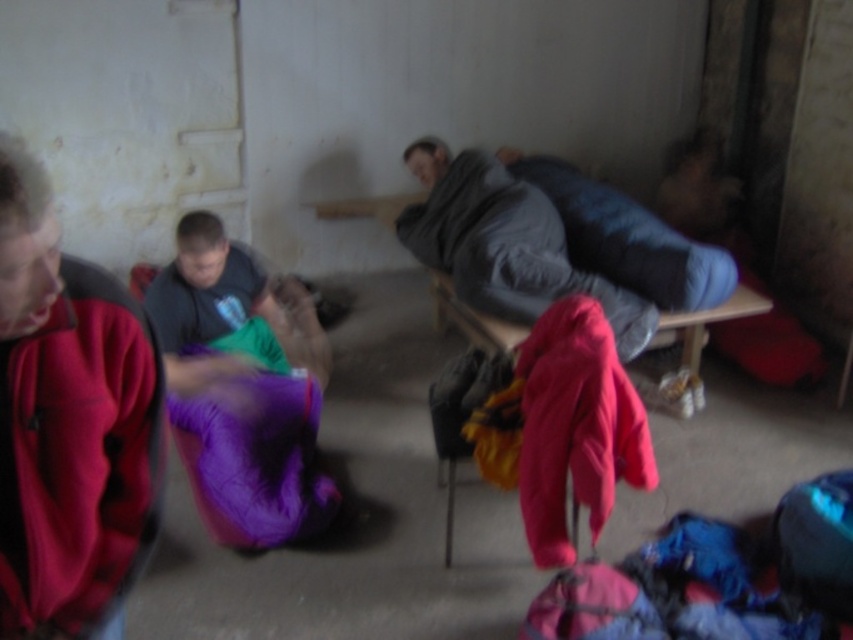
You are a delivery person who needs to place a package between the red fleece jacket at left and the dark gray fabric sleeping bag at center. The package requires at least 5 feet of space to be safely placed. Can you fit it there?

The red fleece jacket at left and dark gray fabric sleeping bag at center are 7.35 feet apart from each other. Since the required space is 5 feet, the package can be safely placed between them as the available space exceeds the minimum requirement.

You are organizing a small event in this dimly lit room and need to place a large table in the center. Considering the red fleece jacket at left and the dark gray fabric sleeping bag at center, which object might you need to move first to make space?

The dark gray fabric sleeping bag at center occupies more space than the red fleece jacket at left, so you should move the dark gray fabric sleeping bag at center first to make space for the table.

You are standing in the shelter and want to retrieve the red fleece jacket at left. However, there is a dark gray fabric sleeping bag at center in your way. Can you reach the jacket without moving the sleeping bag?

The red fleece jacket at left is below the dark gray fabric sleeping bag at center, so you can reach the jacket without moving the sleeping bag because it is positioned lower and accessible underneath.